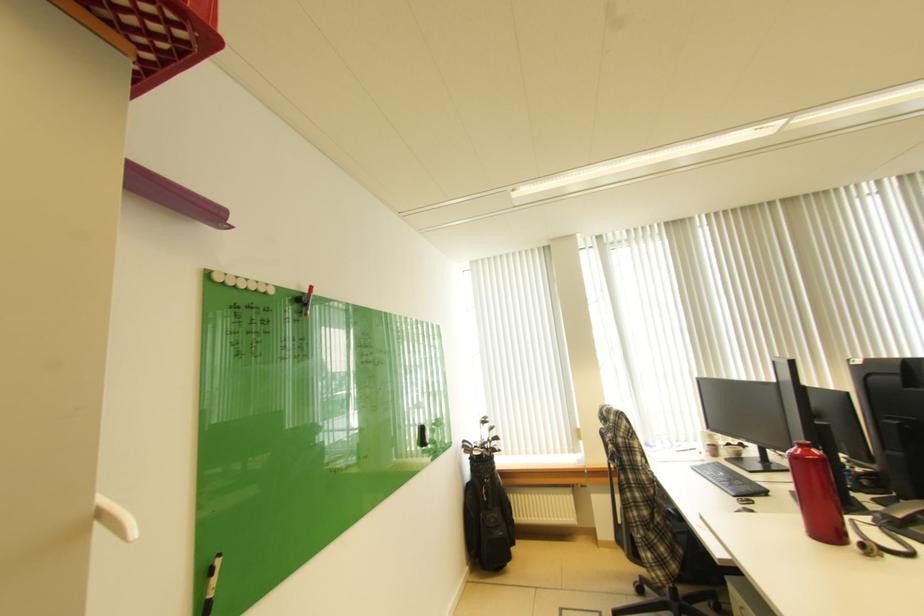
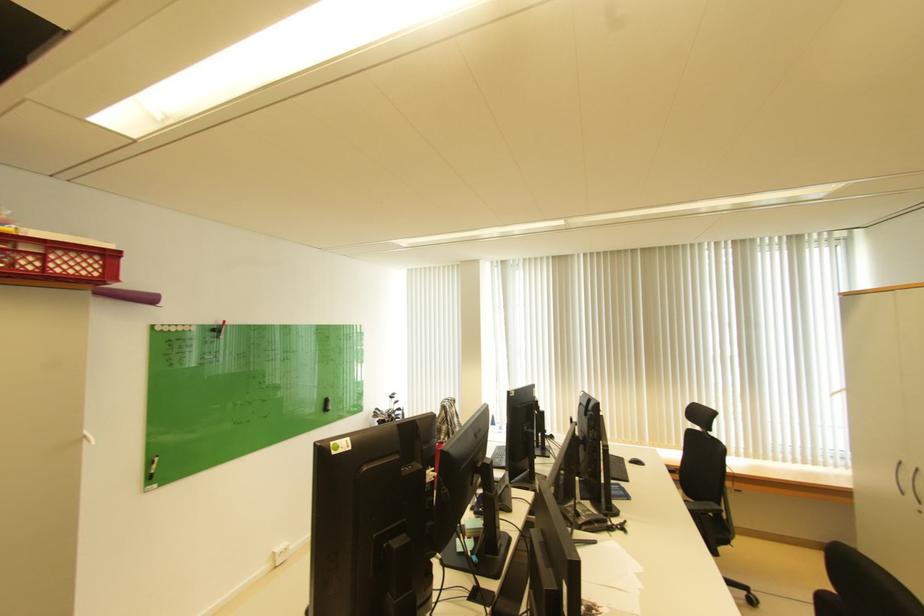
Find the pixel in the second image that matches the point at 307,296 in the first image.

(223, 329)